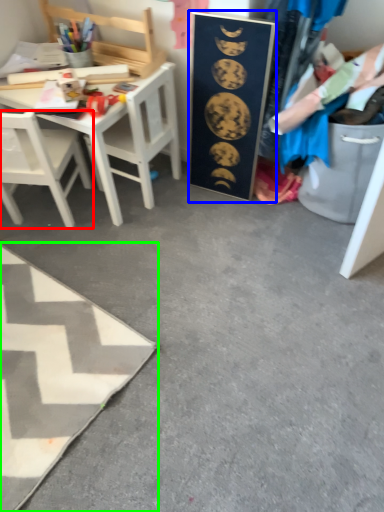
Question: Estimate the real-world distances between objects in this image. Which object is closer to chair (highlighted by a red box), bulletin board (highlighted by a blue box) or table (highlighted by a green box)?

Choices:
 (A) bulletin board
 (B) table

Answer: (B)